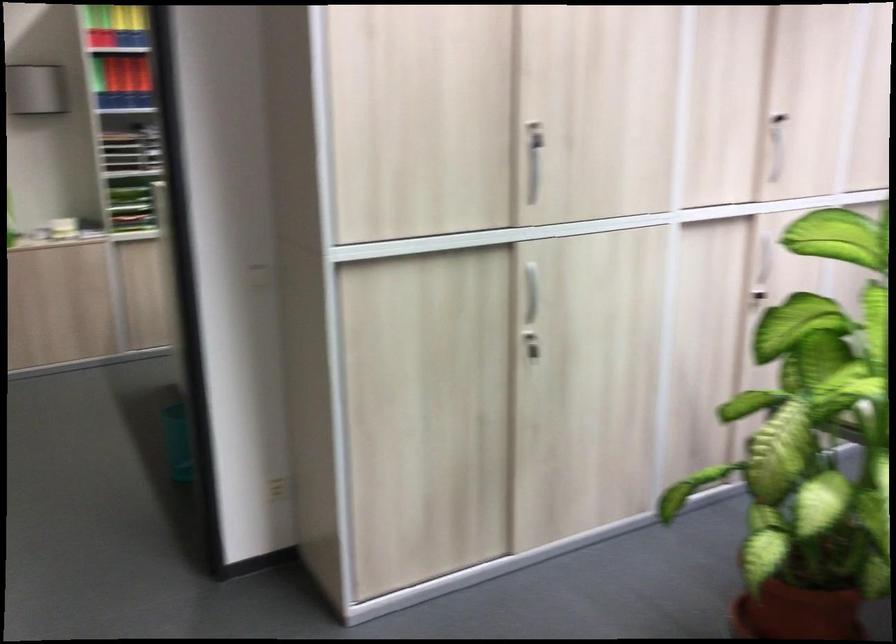
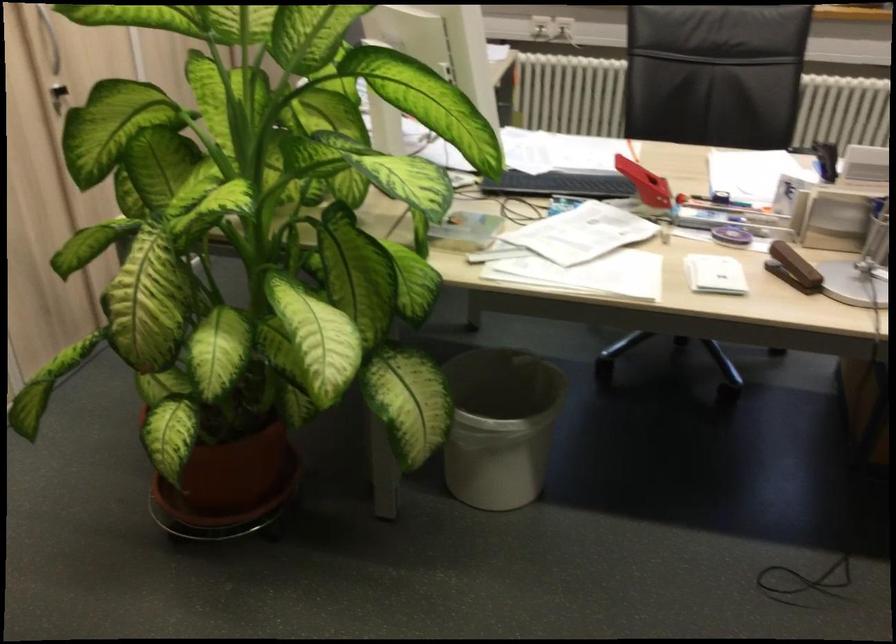
Find the pixel in the second image that matches point (750, 298) in the first image.

(57, 96)